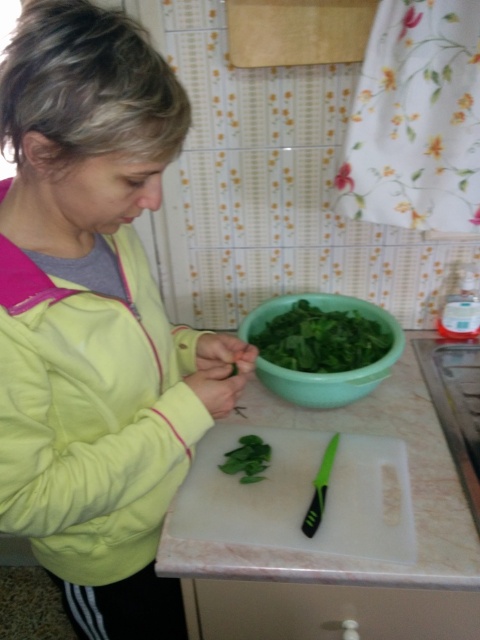
Does point (62, 371) come in front of point (333, 390)?

That is True.

Can you confirm if yellow fabric jacket at center is thinner than green plastic bowl at center?

Incorrect, yellow fabric jacket at center's width is not less than green plastic bowl at center's.

Does point (131, 193) lie in front of point (328, 374)?

Yes.

Locate an element on the screen. yellow fabric jacket at center is located at coordinates (95, 317).

Is the position of yellow fabric jacket at center more distant than that of white plastic cutting board at center?

No, it is not.

Who is more forward, [13,403] or [347,538]?

Point [13,403] is more forward.

Does point (98, 138) lie in front of point (277, 456)?

Yes, point (98, 138) is closer to viewer.

Image resolution: width=480 pixels, height=640 pixels. Identify the location of yellow fabric jacket at center. (95, 317).

Identify the location of yellow fabric jacket at center. (95, 317).

Which of these two, yellow fabric jacket at center or green leafy vegetable at center, stands taller?

yellow fabric jacket at center is taller.

Locate an element on the screen. This screenshot has width=480, height=640. yellow fabric jacket at center is located at coordinates (95, 317).

Locate an element on the screen. The height and width of the screenshot is (640, 480). yellow fabric jacket at center is located at coordinates (95, 317).